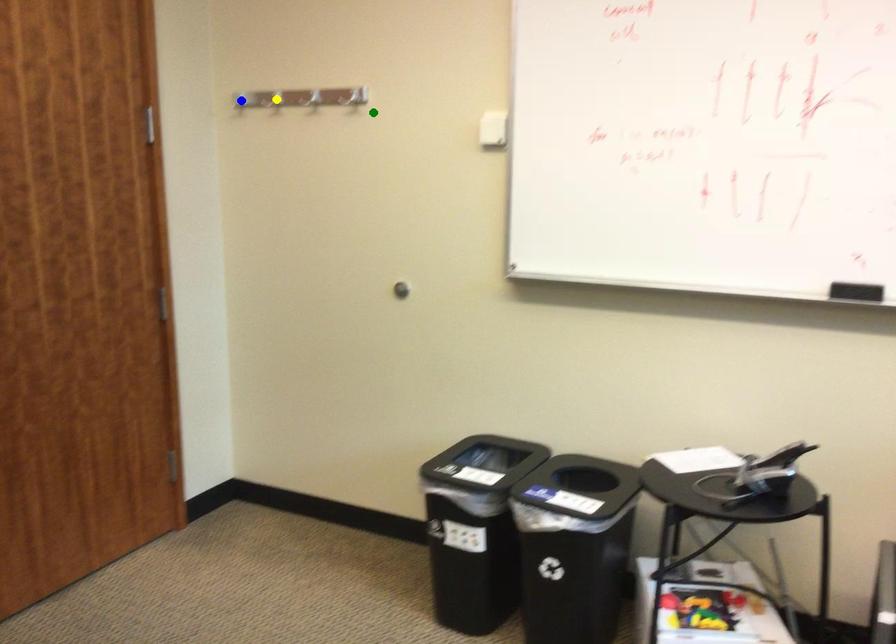
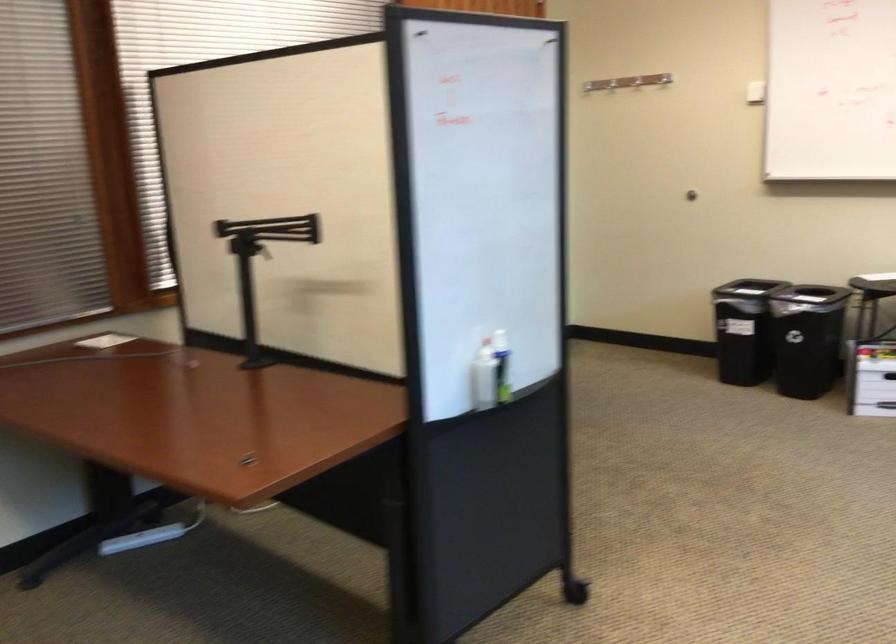
I am providing you with two images of the same scene from different viewpoints. Three points are marked in image1. Which point corresponds to a part or object that is occluded in image2?In image1, three points are marked. Which of them correspond to a part or object that is occluded in image2?Among the three points shown in image1, which one corresponds to a part or object that is no longer visible due to occlusion in image2?

blue point, yellow point